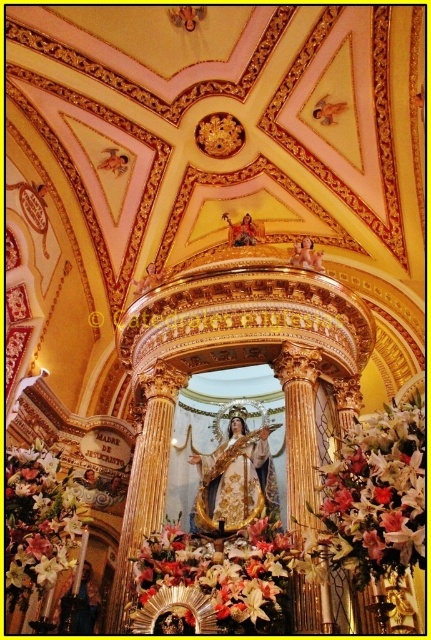
Question: Is white silk flowers at right positioned before white silk flower at lower left?

Choices:
 (A) no
 (B) yes

Answer: (B)

Question: Which of the following is the closest to the observer?

Choices:
 (A) (278, 621)
 (B) (387, 516)

Answer: (B)

Question: Among these objects, which one is nearest to the camera?

Choices:
 (A) floral bouquet at center
 (B) white silk flower at lower left
 (C) white silk flowers at right

Answer: (C)

Question: Which point is closer to the camera taking this photo?

Choices:
 (A) (16, 552)
 (B) (353, 499)

Answer: (B)

Question: Where is floral bouquet at center located in relation to white silk flower at lower left in the image?

Choices:
 (A) below
 (B) above

Answer: (A)

Question: Is white silk flowers at right to the right of white silk flower at lower left from the viewer's perspective?

Choices:
 (A) no
 (B) yes

Answer: (B)